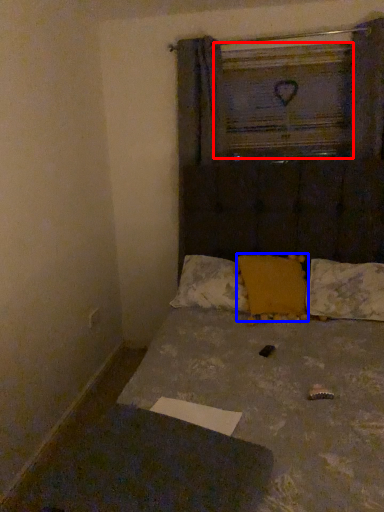
Question: Which object appears closest to the camera in this image, window frame (highlighted by a red box) or pillow (highlighted by a blue box)?

Choices:
 (A) window frame
 (B) pillow

Answer: (B)